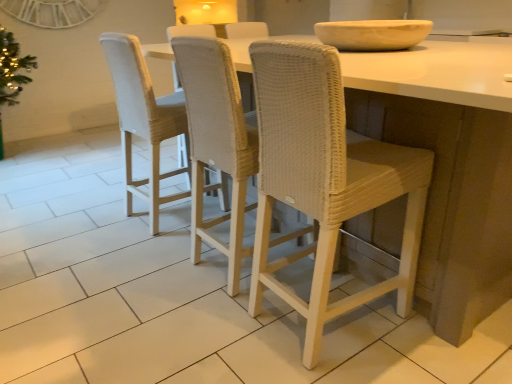
Find the location of a particular element. The image size is (512, 384). white woven stool at center is located at coordinates [x=448, y=174].

Describe the element at coordinates (217, 142) in the screenshot. Image resolution: width=512 pixels, height=384 pixels. I see `woven beige chair at center, marked as the second chair in a right-to-left arrangement` at that location.

Locate an element on the screen. This screenshot has width=512, height=384. woven beige chair at center, placed as the first chair when sorted from left to right is located at coordinates 144,120.

This screenshot has height=384, width=512. I want to click on white woven stool at center, so click(448, 174).

Can you confirm if white woven stool at center is taller than woven beige chair at center, the 3th chair viewed from the right?

Incorrect, the height of white woven stool at center is not larger of that of woven beige chair at center, the 3th chair viewed from the right.

Is white woven stool at center touching woven beige chair at center, the 3th chair viewed from the right?

No, white woven stool at center is not touching woven beige chair at center, the 3th chair viewed from the right.

From the image's perspective, does white woven stool at center appear lower than woven beige chair at center, the 3th chair viewed from the right?

Yes, from the image's perspective, white woven stool at center is beneath woven beige chair at center, the 3th chair viewed from the right.

Is point (375, 277) more distant than point (164, 134)?

No, (375, 277) is closer to viewer.

Is woven beige chair at center, placed as the first chair when sorted from left to right, wider or thinner than beige stone bowl at upper center?

Considering their sizes, woven beige chair at center, placed as the first chair when sorted from left to right, looks slimmer than beige stone bowl at upper center.

From a real-world perspective, which is physically below, woven beige chair at center, placed as the first chair when sorted from left to right, or beige stone bowl at upper center?

In real-world perspective, woven beige chair at center, placed as the first chair when sorted from left to right, is lower.

Consider the image. Between woven beige chair at center, placed as the first chair when sorted from left to right, and beige stone bowl at upper center, which one appears on the left side from the viewer's perspective?

woven beige chair at center, placed as the first chair when sorted from left to right, is more to the left.

Looking at this image, considering the sizes of objects woven beige chair at center, placed as the first chair when sorted from left to right, and beige stone bowl at upper center in the image provided, who is shorter, woven beige chair at center, placed as the first chair when sorted from left to right, or beige stone bowl at upper center?

Standing shorter between the two is beige stone bowl at upper center.

Which is more to the right, beige stone bowl at upper center or white woven stool at center?

beige stone bowl at upper center is more to the right.

Which object is further away from the camera taking this photo, beige stone bowl at upper center or white woven stool at center?

beige stone bowl at upper center is further away from the camera.

Does beige stone bowl at upper center have a smaller size compared to white woven stool at center?

Indeed, beige stone bowl at upper center has a smaller size compared to white woven stool at center.

How many degrees apart are the facing directions of beige stone bowl at upper center and white woven stool at center?

The angular difference between beige stone bowl at upper center and white woven stool at center is 1.3 degrees.

Could you tell me if beige stone bowl at upper center is facing woven beige chair at center, placed as the first chair when sorted from left to right?

No.

Is beige stone bowl at upper center taller than woven beige chair at center, placed as the first chair when sorted from left to right?

Incorrect, the height of beige stone bowl at upper center is not larger of that of woven beige chair at center, placed as the first chair when sorted from left to right.

Which object is wider, beige stone bowl at upper center or woven beige chair at center, the 3th chair viewed from the right?

With larger width is beige stone bowl at upper center.

Between white woven stool at center and woven beige chair at center, marked as the second chair in a right-to-left arrangement, which one has larger size?

white woven stool at center.

Is white woven stool at center oriented towards woven beige chair at center, marked as the second chair in a right-to-left arrangement?

Yes, white woven stool at center faces towards woven beige chair at center, marked as the second chair in a right-to-left arrangement.

Visually, is white woven stool at center positioned to the left or to the right of woven beige chair at center, which ranks as the 2th chair in left-to-right order?

white woven stool at center is to the right of woven beige chair at center, which ranks as the 2th chair in left-to-right order.

Which is closer to the camera, (x=400, y=121) or (x=247, y=140)?

The point (x=400, y=121) is in front.

How different are the orientations of woven beige chair at center, marked as the second chair in a right-to-left arrangement, and woven beige chair at center, the 3th chair viewed from the right, in degrees?

The angle between the facing direction of woven beige chair at center, marked as the second chair in a right-to-left arrangement, and the facing direction of woven beige chair at center, the 3th chair viewed from the right, is 2.5 degrees.

Can we say woven beige chair at center, which ranks as the 2th chair in left-to-right order, lies outside woven beige chair at center, the 3th chair viewed from the right?

Yes, woven beige chair at center, which ranks as the 2th chair in left-to-right order, is outside of woven beige chair at center, the 3th chair viewed from the right.

The width and height of the screenshot is (512, 384). I want to click on the 2nd chair below the woven beige chair at center, which ranks as the 2th chair in left-to-right order (from a real-world perspective), so click(x=144, y=120).

Is woven beige chair at center, marked as the second chair in a right-to-left arrangement, oriented towards woven beige chair at center, the 3th chair viewed from the right?

No, woven beige chair at center, marked as the second chair in a right-to-left arrangement, is not oriented towards woven beige chair at center, the 3th chair viewed from the right.

Is the depth of woven beige chair at center, the 3th chair viewed from the right, less than that of woven beige chair at center, marked as the second chair in a right-to-left arrangement?

No, woven beige chair at center, the 3th chair viewed from the right, is behind woven beige chair at center, marked as the second chair in a right-to-left arrangement.

Based on their positions, is woven beige chair at center, placed as the first chair when sorted from left to right, located to the left or right of woven beige chair at center, marked as the second chair in a right-to-left arrangement?

From the image, it's evident that woven beige chair at center, placed as the first chair when sorted from left to right, is to the left of woven beige chair at center, marked as the second chair in a right-to-left arrangement.

From the image's perspective, relative to woven beige chair at center, marked as the second chair in a right-to-left arrangement, is woven beige chair at center, placed as the first chair when sorted from left to right, above or below?

woven beige chair at center, placed as the first chair when sorted from left to right, is situated higher than woven beige chair at center, marked as the second chair in a right-to-left arrangement, in the image.

Is woven beige chair at center, placed as the first chair when sorted from left to right, outside of woven beige chair at center, which ranks as the 2th chair in left-to-right order?

That's correct, woven beige chair at center, placed as the first chair when sorted from left to right, is outside of woven beige chair at center, which ranks as the 2th chair in left-to-right order.

Image resolution: width=512 pixels, height=384 pixels. I want to click on the 1st chair directly above the white woven stool at center (from a real-world perspective), so click(144, 120).

Locate an element on the screen. the 3rd chair to the left when counting from the beige stone bowl at upper center is located at coordinates (144, 120).

Considering their positions, is beige stone bowl at upper center positioned closer to woven beige chair at center, placed as the first chair when sorted from left to right, than white woven stool at center?

Based on the image, beige stone bowl at upper center appears to be nearer to woven beige chair at center, placed as the first chair when sorted from left to right.

From the image, which object appears to be farther from white wicker chair at center, which ranks as the 1th chair in right-to-left order, beige stone bowl at upper center or woven beige chair at center, the 3th chair viewed from the right?

woven beige chair at center, the 3th chair viewed from the right.

Based on their spatial positions, is beige stone bowl at upper center or woven beige chair at center, the 3th chair viewed from the right, closer to woven beige chair at center, which ranks as the 2th chair in left-to-right order?

Based on the image, woven beige chair at center, the 3th chair viewed from the right, appears to be nearer to woven beige chair at center, which ranks as the 2th chair in left-to-right order.

From the image, which object appears to be nearer to white wicker chair at center, the third chair in the left-to-right sequence, white woven stool at center or woven beige chair at center, the 3th chair viewed from the right?

Based on the image, white woven stool at center appears to be nearer to white wicker chair at center, the third chair in the left-to-right sequence.

Estimate the real-world distances between objects in this image. Which object is further from white wicker chair at center, the third chair in the left-to-right sequence, woven beige chair at center, which ranks as the 2th chair in left-to-right order, or beige stone bowl at upper center?

beige stone bowl at upper center is further to white wicker chair at center, the third chair in the left-to-right sequence.

In the scene shown: When comparing their distances from woven beige chair at center, the 3th chair viewed from the right, does white woven stool at center or white wicker chair at center, which ranks as the 1th chair in right-to-left order, seem further?

Among the two, white woven stool at center is located further to woven beige chair at center, the 3th chair viewed from the right.

From the image, which object appears to be nearer to woven beige chair at center, marked as the second chair in a right-to-left arrangement, woven beige chair at center, the 3th chair viewed from the right, or beige stone bowl at upper center?

woven beige chair at center, the 3th chair viewed from the right, is positioned closer to the anchor woven beige chair at center, marked as the second chair in a right-to-left arrangement.

Considering their positions, is white wicker chair at center, the third chair in the left-to-right sequence, positioned further to white woven stool at center than woven beige chair at center, placed as the first chair when sorted from left to right?

woven beige chair at center, placed as the first chair when sorted from left to right, is further to white woven stool at center.

Find the location of a particular element. The image size is (512, 384). chair between white wicker chair at center, which ranks as the 1th chair in right-to-left order, and woven beige chair at center, the 3th chair viewed from the right, in the front-back direction is located at coordinates (217, 142).

The height and width of the screenshot is (384, 512). What are the coordinates of `chair positioned between white woven stool at center and woven beige chair at center, which ranks as the 2th chair in left-to-right order, from near to far` in the screenshot? It's located at (325, 179).

Identify the location of bowl located between white woven stool at center and woven beige chair at center, placed as the first chair when sorted from left to right, in the depth direction. This screenshot has width=512, height=384. (373, 34).